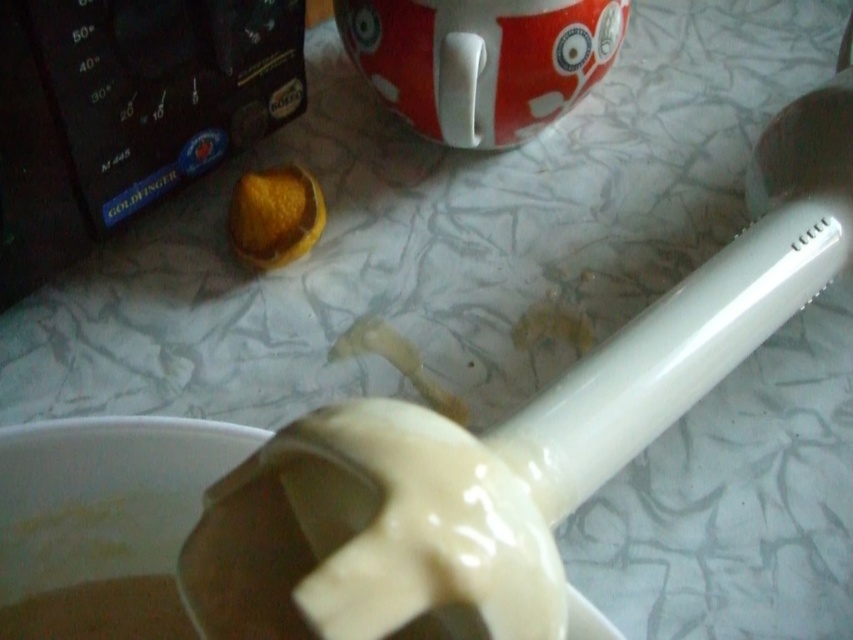
Question: Is white glossy spoon at center positioned at the back of orange peel at center?

Choices:
 (A) yes
 (B) no

Answer: (B)

Question: Which object is farther from the camera taking this photo?

Choices:
 (A) orange peel at center
 (B) white glossy spoon at center

Answer: (A)

Question: Does white glossy spoon at center have a lesser width compared to orange peel at center?

Choices:
 (A) no
 (B) yes

Answer: (A)

Question: Observing the image, what is the correct spatial positioning of white glossy spoon at center in reference to orange peel at center?

Choices:
 (A) right
 (B) left

Answer: (A)